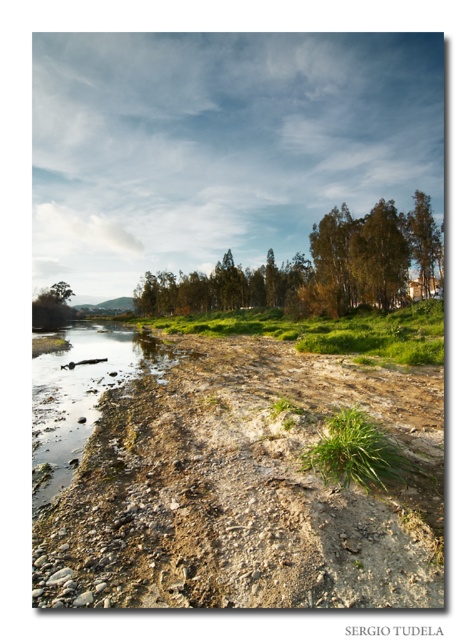
Does green leafy tree at upper center appear on the left side of green leafy tree at upper left?

No, green leafy tree at upper center is not to the left of green leafy tree at upper left.

This screenshot has height=640, width=476. Describe the element at coordinates (315, 268) in the screenshot. I see `green leafy tree at upper center` at that location.

You are a GUI agent. You are given a task and a screenshot of the screen. Output one action in this format:
    pyautogui.click(x=<x>, y=<y>)
    Task: Click on the green leafy tree at upper center
    
    Given the screenshot: What is the action you would take?
    tap(315, 268)

Is green leafy tree at upper center thinner than green leafy tree at upper right?

No, green leafy tree at upper center is not thinner than green leafy tree at upper right.

Does green leafy tree at upper center have a lesser height compared to green leafy tree at upper right?

In fact, green leafy tree at upper center may be taller than green leafy tree at upper right.

Image resolution: width=476 pixels, height=640 pixels. Identify the location of green leafy tree at upper center. (315, 268).

Is point (132, 595) farther from camera compared to point (348, 458)?

No, it is not.

Can you confirm if brown rough dirt field at lower left is thinner than green leafy grass at center?

Incorrect, brown rough dirt field at lower left's width is not less than green leafy grass at center's.

Does point (425, 541) lie in front of point (340, 458)?

Yes, it is in front of point (340, 458).

In order to click on brown rough dirt field at lower left in this screenshot , I will do `click(247, 490)`.